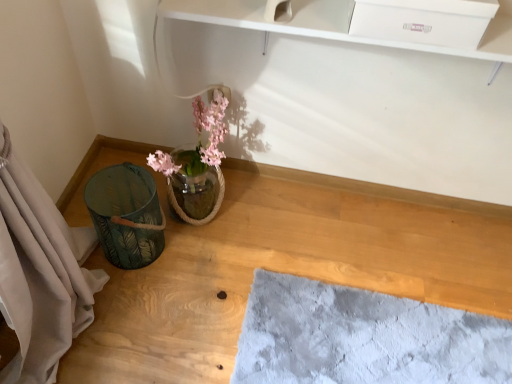
I want to click on vacant space to the right of translucent glass vase at center, so click(x=261, y=228).